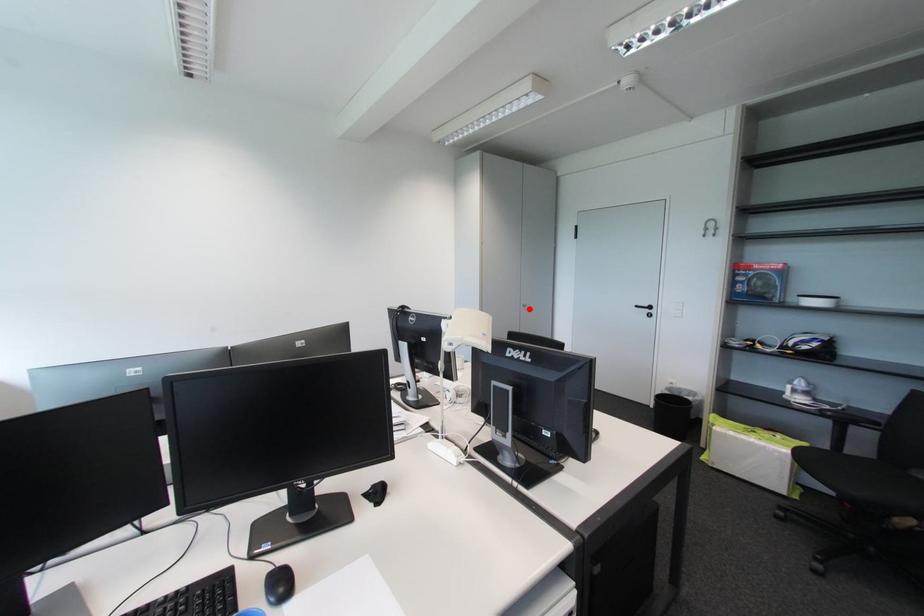
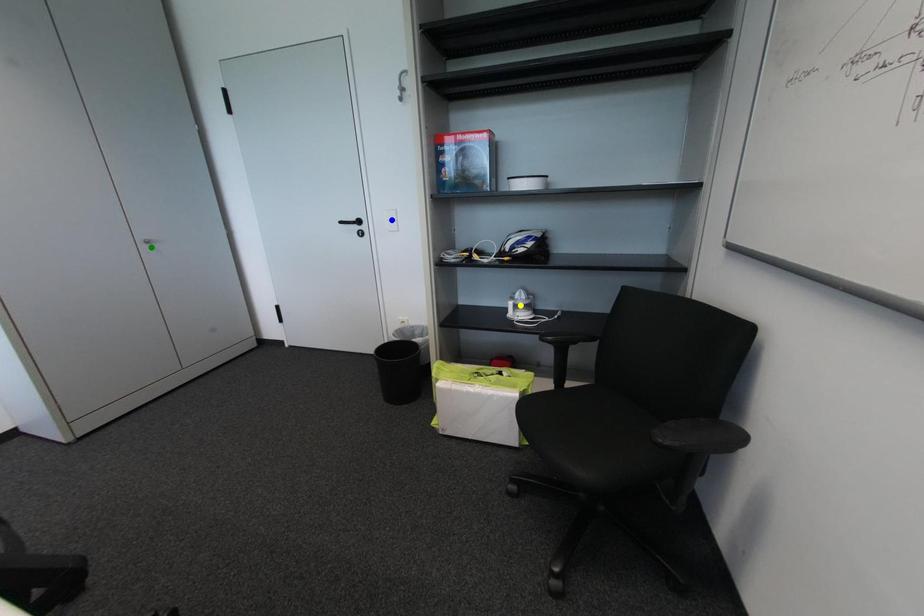
Question: I am providing you with two images of the same scene from different viewpoints. A red point is marked on the first image. You are given multiple points on the second image. Which mark in image 2 goes with the point in image 1?

Choices:
 (A) yellow point
 (B) green point
 (C) blue point

Answer: (B)